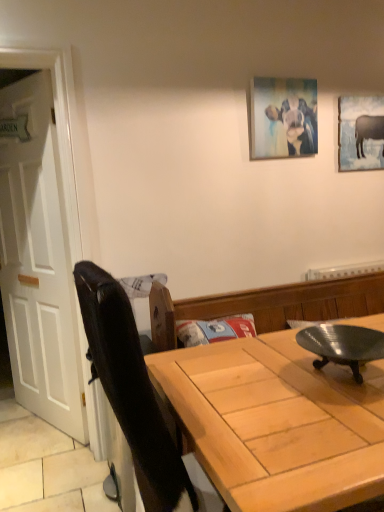
Question: From a real-world perspective, is metallic silver plate at center positioned over white wooden door at left based on gravity?

Choices:
 (A) yes
 (B) no

Answer: (B)

Question: Is metallic silver plate at center oriented towards white wooden door at left?

Choices:
 (A) no
 (B) yes

Answer: (A)

Question: From the image's perspective, is metallic silver plate at center beneath white wooden door at left?

Choices:
 (A) yes
 (B) no

Answer: (A)

Question: From the image's perspective, is metallic silver plate at center located above white wooden door at left?

Choices:
 (A) no
 (B) yes

Answer: (A)

Question: Can white wooden door at left be found inside metallic silver plate at center?

Choices:
 (A) yes
 (B) no

Answer: (B)

Question: From a real-world perspective, is matte canvas painting at upper center, marked as the 2th picture frame in a back-to-front arrangement, above or below white wooden door at left?

Choices:
 (A) above
 (B) below

Answer: (A)

Question: From the image's perspective, relative to white wooden door at left, is matte canvas painting at upper center, marked as the 2th picture frame in a back-to-front arrangement, above or below?

Choices:
 (A) above
 (B) below

Answer: (A)

Question: Considering the positions of matte canvas painting at upper center, acting as the 1th picture frame starting from the front, and white wooden door at left in the image, is matte canvas painting at upper center, acting as the 1th picture frame starting from the front, taller or shorter than white wooden door at left?

Choices:
 (A) tall
 (B) short

Answer: (B)

Question: Is point 253,110 positioned closer to the camera than point 26,232?

Choices:
 (A) farther
 (B) closer

Answer: (B)

Question: Is light wood table at center inside the boundaries of white wooden door at left, or outside?

Choices:
 (A) inside
 (B) outside

Answer: (B)

Question: In terms of size, does light wood table at center appear bigger or smaller than white wooden door at left?

Choices:
 (A) big
 (B) small

Answer: (A)

Question: Looking at their shapes, would you say light wood table at center is wider or thinner than white wooden door at left?

Choices:
 (A) thin
 (B) wide

Answer: (B)

Question: Based on their positions, is light wood table at center located to the left or right of white wooden door at left?

Choices:
 (A) left
 (B) right

Answer: (B)

Question: From the image's perspective, is metallic silver plate at center located above or below light wood table at center?

Choices:
 (A) above
 (B) below

Answer: (A)

Question: Does point (319, 362) appear closer or farther from the camera than point (329, 370)?

Choices:
 (A) closer
 (B) farther

Answer: (B)